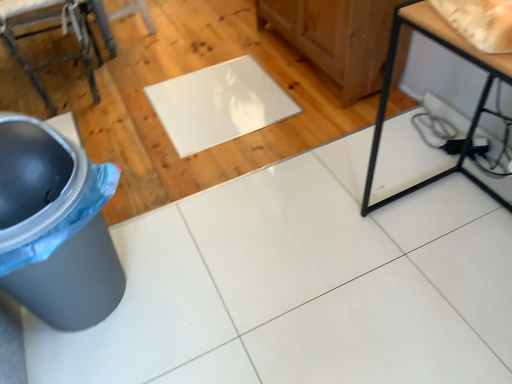
Question: Is black metal table at lower right next to glossy white mat at center?

Choices:
 (A) yes
 (B) no

Answer: (B)

Question: Can you confirm if black metal table at lower right is bigger than glossy white mat at center?

Choices:
 (A) yes
 (B) no

Answer: (A)

Question: Can we say black metal table at lower right lies outside glossy white mat at center?

Choices:
 (A) no
 (B) yes

Answer: (B)

Question: Is black metal table at lower right looking in the opposite direction of glossy white mat at center?

Choices:
 (A) yes
 (B) no

Answer: (B)

Question: Can glossy white mat at center be found inside black metal table at lower right?

Choices:
 (A) yes
 (B) no

Answer: (B)

Question: Is black metal table at lower right facing towards glossy white mat at center?

Choices:
 (A) yes
 (B) no

Answer: (B)

Question: Can you confirm if black metal table at lower right is smaller than gray plastic trash can at lower left?

Choices:
 (A) yes
 (B) no

Answer: (B)

Question: Considering the relative sizes of black metal table at lower right and gray plastic trash can at lower left in the image provided, is black metal table at lower right bigger than gray plastic trash can at lower left?

Choices:
 (A) no
 (B) yes

Answer: (B)

Question: Can you confirm if black metal table at lower right is thinner than gray plastic trash can at lower left?

Choices:
 (A) yes
 (B) no

Answer: (B)

Question: From a real-world perspective, does black metal table at lower right sit lower than gray plastic trash can at lower left?

Choices:
 (A) yes
 (B) no

Answer: (B)

Question: From the image's perspective, is black metal table at lower right located beneath gray plastic trash can at lower left?

Choices:
 (A) yes
 (B) no

Answer: (B)

Question: Is black metal table at lower right aimed at gray plastic trash can at lower left?

Choices:
 (A) yes
 (B) no

Answer: (A)

Question: Would you say glossy white mat at center is a long distance from gray plastic trash can at lower left?

Choices:
 (A) yes
 (B) no

Answer: (B)